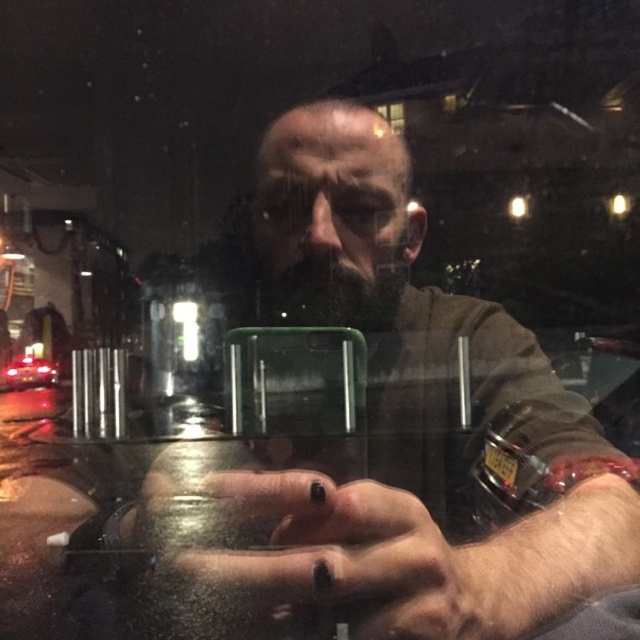
Between matte black wristwatch at center and clear glass window at upper center, which one appears on the right side from the viewer's perspective?

Positioned to the right is clear glass window at upper center.

Does matte black wristwatch at center have a smaller size compared to clear glass window at upper center?

No.

Who is more distant from viewer, (388, 177) or (387, 122)?

Point (387, 122)

This screenshot has width=640, height=640. What are the coordinates of `matte black wristwatch at center` in the screenshot? It's located at (404, 410).

Which is in front, point (236, 570) or point (390, 108)?

Point (236, 570) is in front.

Does black matte nails at center appear under clear glass window at upper center?

Indeed, black matte nails at center is positioned under clear glass window at upper center.

The width and height of the screenshot is (640, 640). What are the coordinates of `black matte nails at center` in the screenshot? It's located at (344, 556).

Does shiny red car at center come in front of clear glass window at upper center?

No, it is not.

Which is more to the right, shiny red car at center or clear glass window at upper center?

Positioned to the right is clear glass window at upper center.

Describe the element at coordinates (28, 372) in the screenshot. I see `shiny red car at center` at that location.

In order to click on shiny red car at center in this screenshot , I will do `click(28, 372)`.